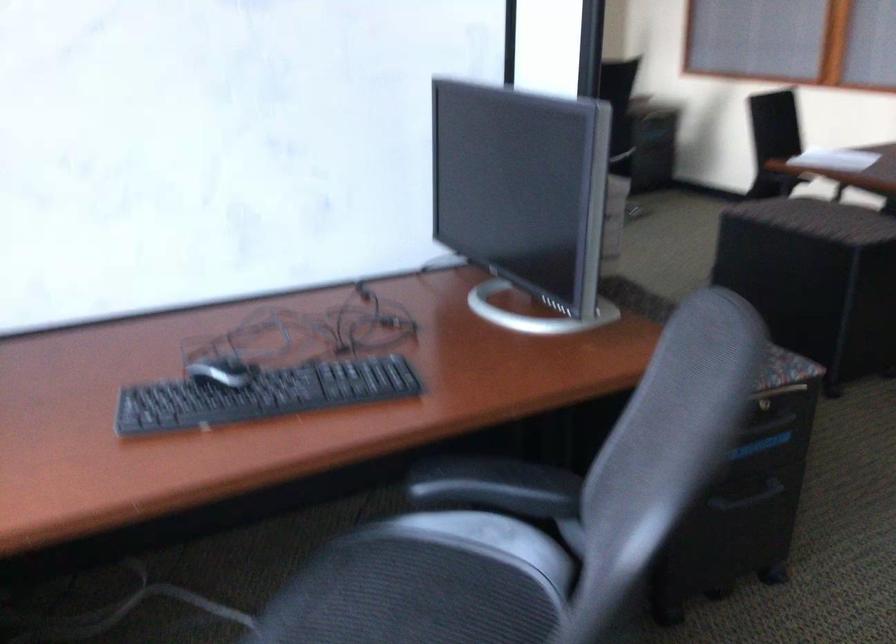
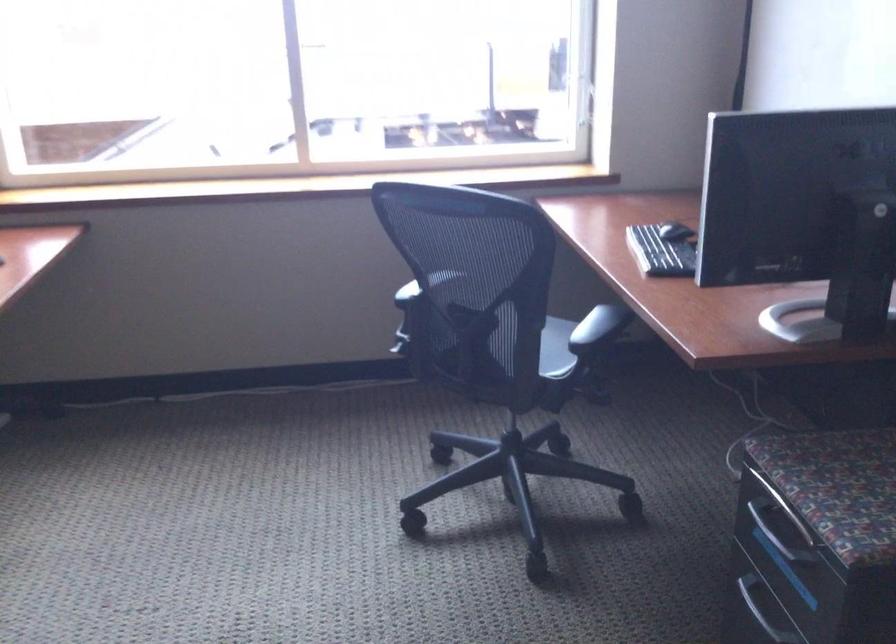
Question: I am providing you with two images of the same scene from different viewpoints. Please identify which objects are invisible in image2.

Choices:
 (A) black computer mouse
 (B) silver drawer handle
 (C) chair armrest
 (D) none of these

Answer: (D)